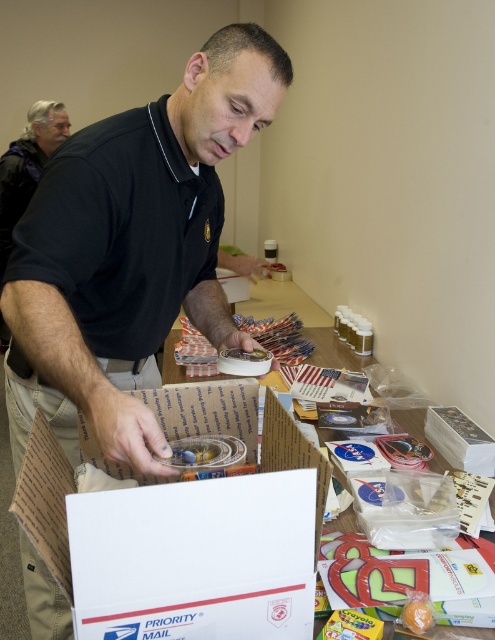
Question: Which point is closer to the camera?

Choices:
 (A) (65, 220)
 (B) (408, 602)

Answer: (B)

Question: Can you confirm if black matte shirt at center is smaller than orange matte/soft orange at lower right?

Choices:
 (A) no
 (B) yes

Answer: (A)

Question: Which object appears farthest from the camera in this image?

Choices:
 (A) black matte shirt at center
 (B) white cardboard box at center
 (C) orange matte/soft orange at lower right

Answer: (C)

Question: Can you confirm if white cardboard box at center is wider than orange matte/soft orange at lower right?

Choices:
 (A) no
 (B) yes

Answer: (B)

Question: Which object is farther from the camera taking this photo?

Choices:
 (A) white cardboard box at center
 (B) black matte shirt at center
 (C) orange matte/soft orange at lower right

Answer: (C)

Question: Can you confirm if black matte shirt at center is positioned to the left of orange matte/soft orange at lower right?

Choices:
 (A) no
 (B) yes

Answer: (B)